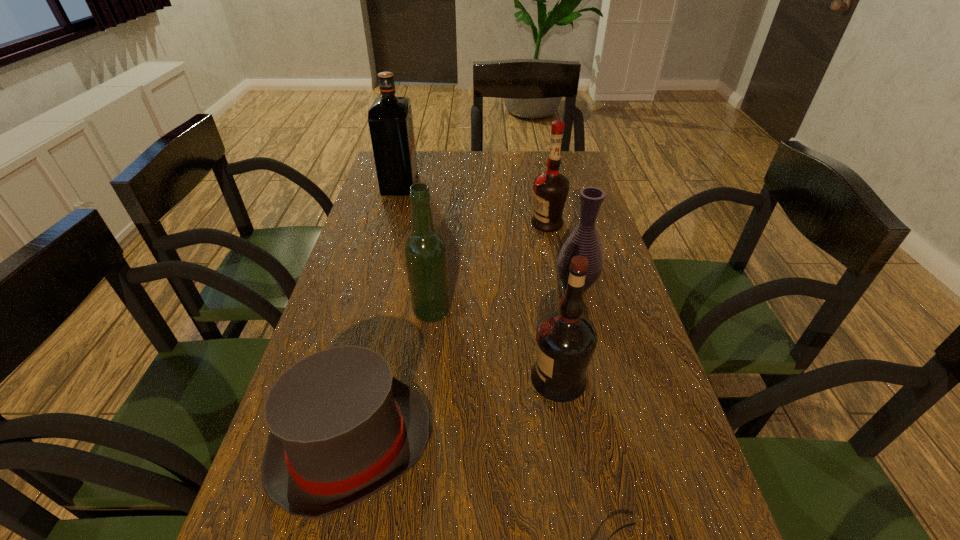
Locate an element on the screen. The image size is (960, 540). vase situated at the right edge is located at coordinates (584, 241).

The height and width of the screenshot is (540, 960). I want to click on object that is at the far left corner, so click(390, 120).

Image resolution: width=960 pixels, height=540 pixels. Identify the location of vacant area at the far edge. (447, 179).

In the image, there is a desktop. In order to click on free space at the left edge in this screenshot , I will do `click(352, 314)`.

Find the location of `vacant area at the right edge of the desktop`. vacant area at the right edge of the desktop is located at coordinates (606, 345).

Identify the location of vacant area between the farthest liquor and the vase. (488, 235).

Find the location of `vacant space that's between the dress hat and the farthest liquor`. vacant space that's between the dress hat and the farthest liquor is located at coordinates (375, 315).

Locate an element on the screen. This screenshot has width=960, height=540. unoccupied area between the farthest liquor and the dress hat is located at coordinates (375, 315).

You are a GUI agent. You are given a task and a screenshot of the screen. Output one action in this format:
    pyautogui.click(x=<x>, y=<y>)
    Task: Click on the vacant area that lies between the third nearest liquor and the third liquor from right to left
    
    Given the screenshot: What is the action you would take?
    pyautogui.click(x=490, y=268)

Where is `free space that is in between the second farthest liquor and the third farthest liquor`? This screenshot has height=540, width=960. free space that is in between the second farthest liquor and the third farthest liquor is located at coordinates (490, 268).